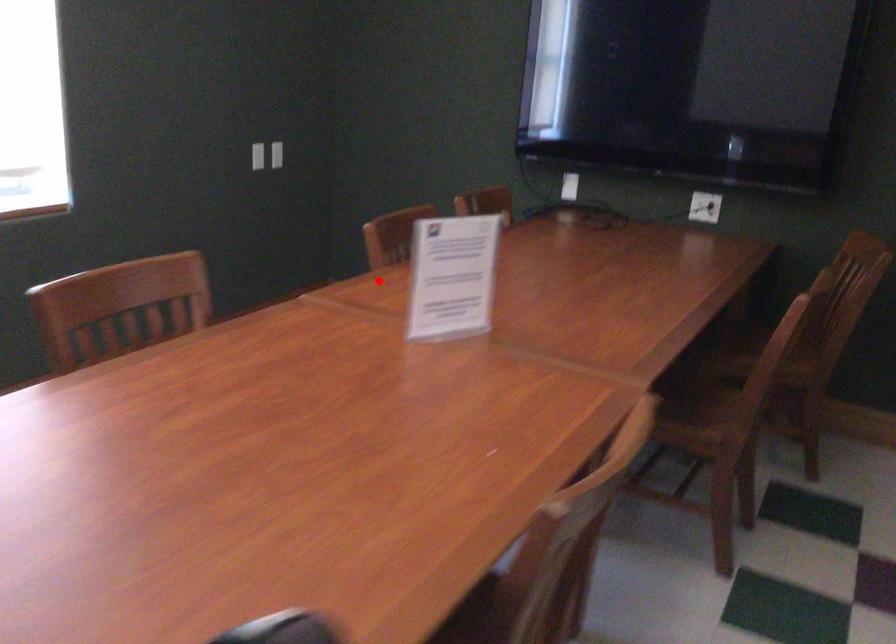
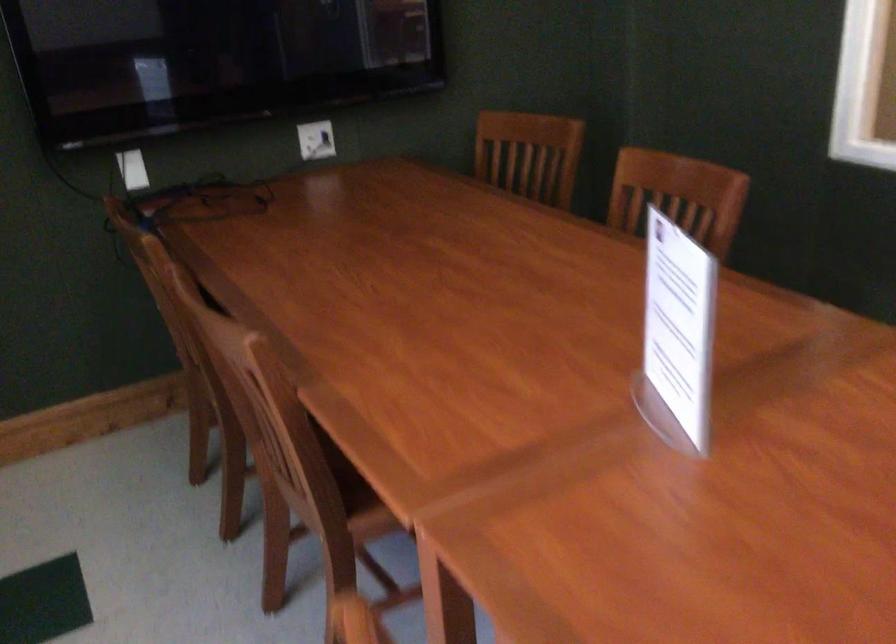
In the second image, find the point that corresponds to the highlighted location in the first image.

(299, 413)